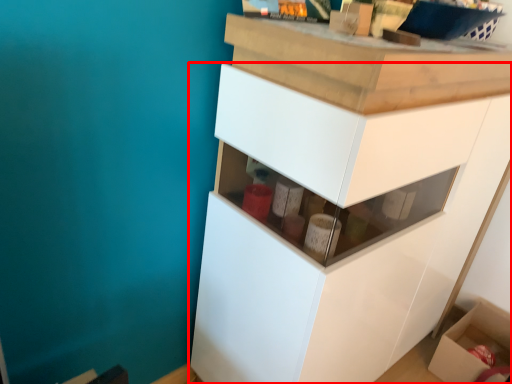
Question: From the image's perspective, where is cabinetry (annotated by the red box) located relative to cardboard box?

Choices:
 (A) above
 (B) below

Answer: (A)